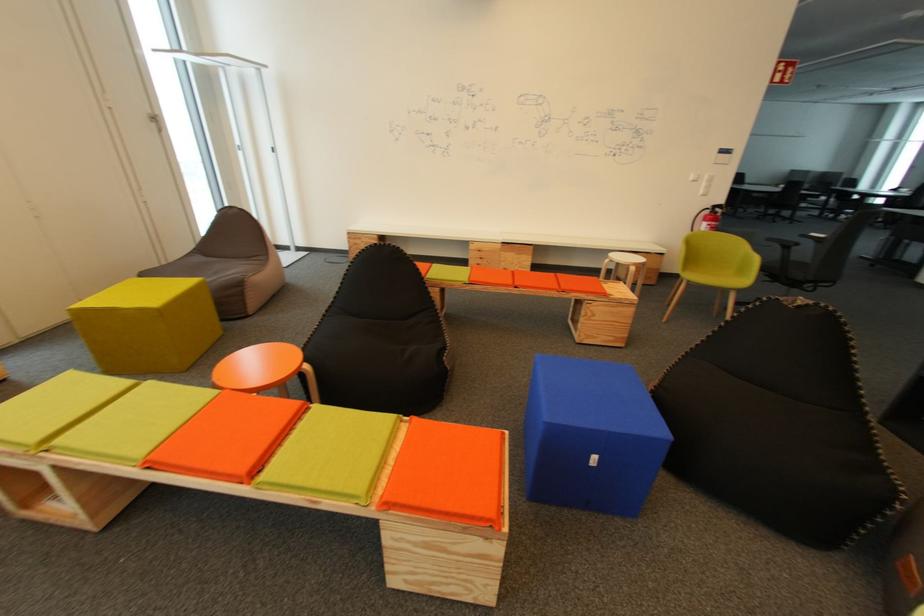
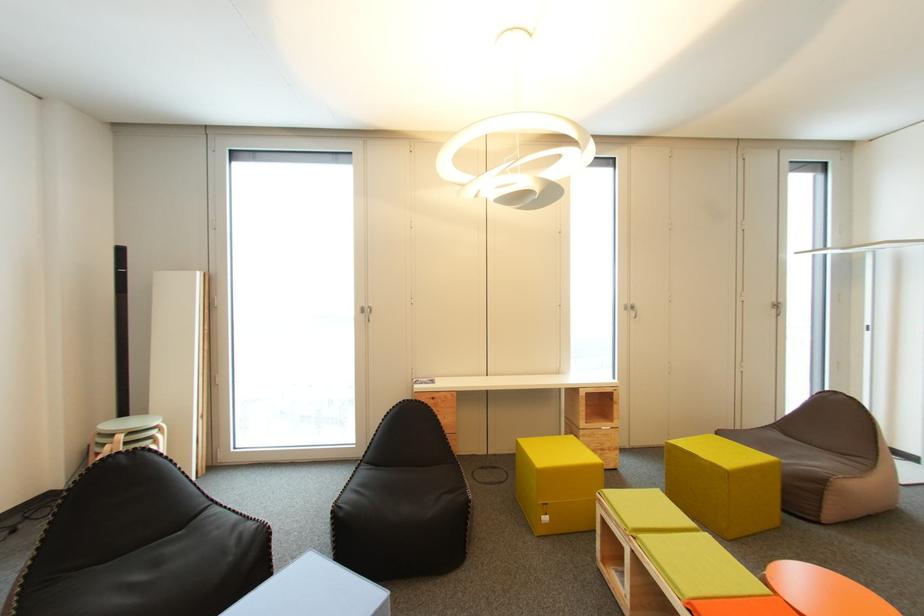
Question: The camera is either moving clockwise (left) or counter-clockwise (right) around the object. The first image is from the beginning of the video and the second image is from the end. Is the camera moving left or right when shooting the video?

Choices:
 (A) Left
 (B) Right

Answer: (B)